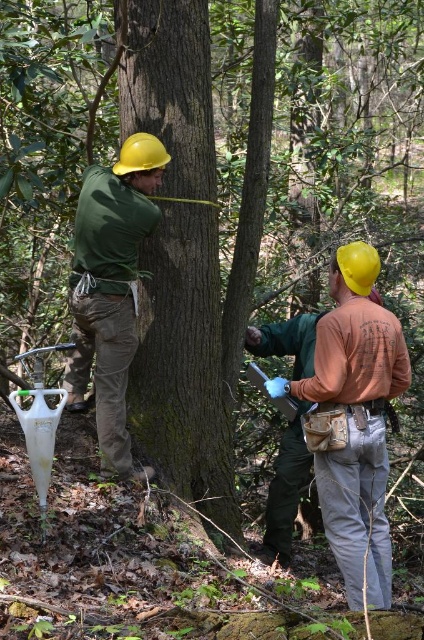
You are a safety inspector in the forest. You need to ensure that the smooth brown tree trunk at center and the matte green shirt at center are at least 20 inches apart to prevent accidental contact. Based on the image, is this requirement met?

The smooth brown tree trunk at center and the matte green shirt at center are 19.55 inches apart from each other, which is less than the required 20 inches. Therefore, the requirement is not met.

You are navigating through a dense forest and need to locate the smooth brown tree trunk at center. Based on the coordinates provided, can you determine its exact location in the image?

The smooth brown tree trunk at center is located at coordinates point (184,364).

You are a researcher in the forest. You have a camera that can capture images up to 15 feet away. You want to take a photo of the smooth brown tree trunk at center. Can you do it from your current position?

The smooth brown tree trunk at center and camera are 15.56 feet apart from each other. Since the camera can only capture up to 15 feet, you cannot take the photo from your current position because the distance is slightly more than the camera can handle.